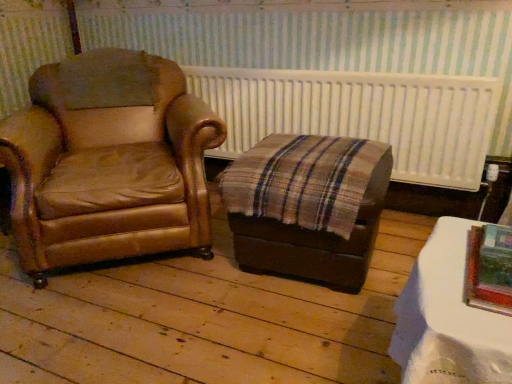
Question: Is brown leather chair at left at the right side of white textured radiator at upper center?

Choices:
 (A) no
 (B) yes

Answer: (A)

Question: Could white textured radiator at upper center be considered to be inside brown leather chair at left?

Choices:
 (A) yes
 (B) no

Answer: (B)

Question: Is brown leather chair at left bigger than white textured radiator at upper center?

Choices:
 (A) no
 (B) yes

Answer: (B)

Question: Is the position of brown leather chair at left more distant than that of white textured radiator at upper center?

Choices:
 (A) no
 (B) yes

Answer: (A)

Question: Is brown leather chair at left not inside white textured radiator at upper center?

Choices:
 (A) no
 (B) yes

Answer: (B)

Question: Does brown leather chair at left have a greater height compared to white textured radiator at upper center?

Choices:
 (A) no
 (B) yes

Answer: (B)

Question: Is metallic silver picture frame at lower right positioned behind white glossy table at lower right?

Choices:
 (A) no
 (B) yes

Answer: (B)

Question: Is metallic silver picture frame at lower right closer to the viewer compared to white glossy table at lower right?

Choices:
 (A) no
 (B) yes

Answer: (A)

Question: Is metallic silver picture frame at lower right placed right next to white glossy table at lower right?

Choices:
 (A) yes
 (B) no

Answer: (A)

Question: Can you confirm if metallic silver picture frame at lower right is thinner than white glossy table at lower right?

Choices:
 (A) no
 (B) yes

Answer: (B)

Question: From a real-world perspective, is metallic silver picture frame at lower right over white glossy table at lower right?

Choices:
 (A) yes
 (B) no

Answer: (A)

Question: Is metallic silver picture frame at lower right smaller than white glossy table at lower right?

Choices:
 (A) yes
 (B) no

Answer: (A)

Question: Is white glossy table at lower right to the left of metallic silver picture frame at lower right from the viewer's perspective?

Choices:
 (A) yes
 (B) no

Answer: (A)